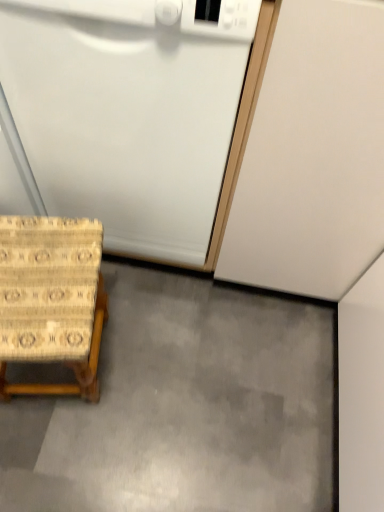
Question: Is white matte dishwasher at lower left turned away from gray smooth concrete at lower center?

Choices:
 (A) yes
 (B) no

Answer: (B)

Question: Is white matte dishwasher at lower left smaller than gray smooth concrete at lower center?

Choices:
 (A) no
 (B) yes

Answer: (A)

Question: Is white matte dishwasher at lower left further to camera compared to gray smooth concrete at lower center?

Choices:
 (A) yes
 (B) no

Answer: (B)

Question: From the image's perspective, does white matte dishwasher at lower left appear higher than gray smooth concrete at lower center?

Choices:
 (A) yes
 (B) no

Answer: (A)

Question: Does white matte dishwasher at lower left have a larger size compared to gray smooth concrete at lower center?

Choices:
 (A) yes
 (B) no

Answer: (A)

Question: Considering the relative sizes of white matte dishwasher at lower left and gray smooth concrete at lower center in the image provided, is white matte dishwasher at lower left thinner than gray smooth concrete at lower center?

Choices:
 (A) no
 (B) yes

Answer: (B)

Question: Is beige woven stool at lower left smaller than gray smooth concrete at lower center?

Choices:
 (A) yes
 (B) no

Answer: (B)

Question: Are beige woven stool at lower left and gray smooth concrete at lower center located far from each other?

Choices:
 (A) yes
 (B) no

Answer: (B)

Question: From the image's perspective, does beige woven stool at lower left appear lower than gray smooth concrete at lower center?

Choices:
 (A) yes
 (B) no

Answer: (B)

Question: Is beige woven stool at lower left facing towards gray smooth concrete at lower center?

Choices:
 (A) no
 (B) yes

Answer: (A)

Question: Is beige woven stool at lower left in contact with gray smooth concrete at lower center?

Choices:
 (A) yes
 (B) no

Answer: (B)

Question: From a real-world perspective, is beige woven stool at lower left beneath gray smooth concrete at lower center?

Choices:
 (A) yes
 (B) no

Answer: (B)

Question: From a real-world perspective, is gray smooth concrete at lower center under beige woven stool at lower left?

Choices:
 (A) no
 (B) yes

Answer: (B)